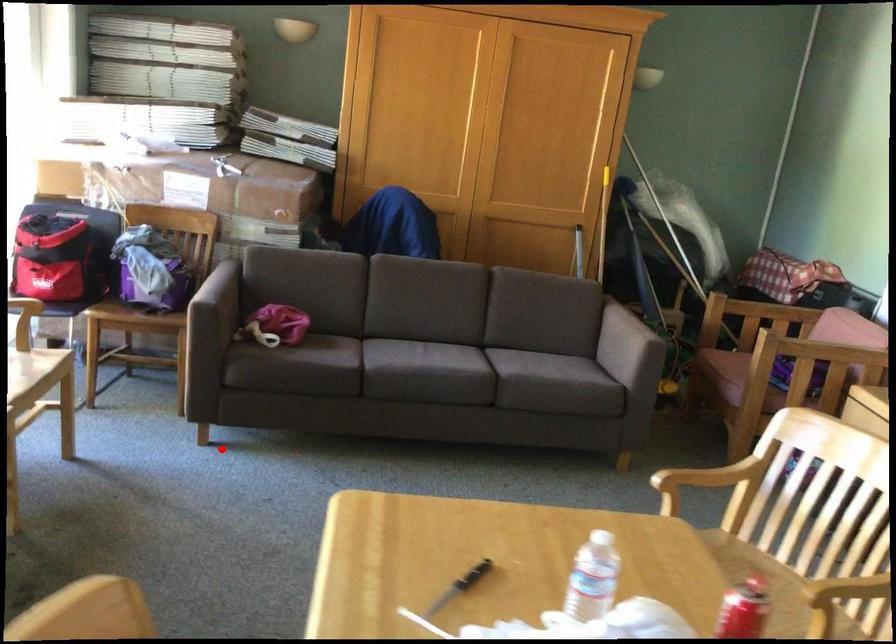
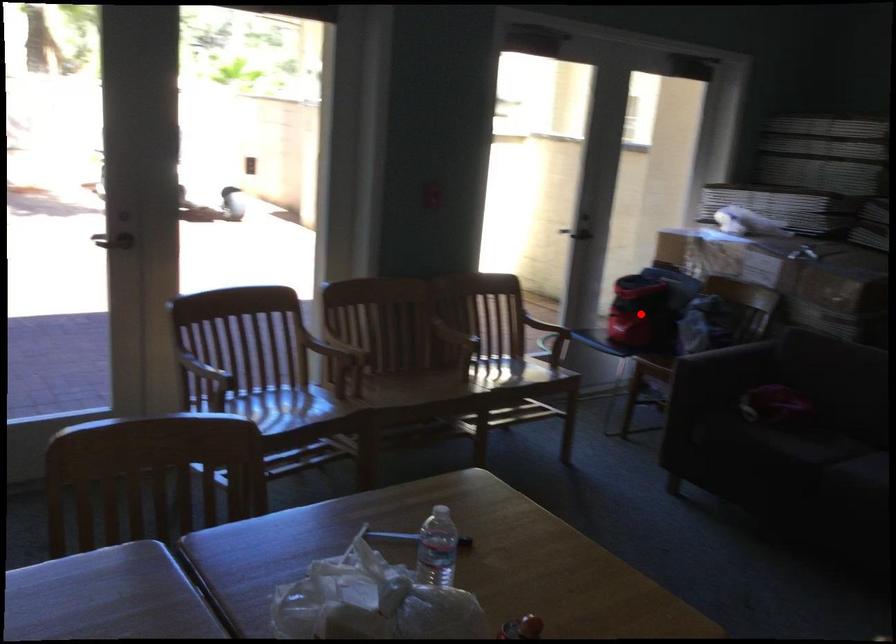
I am providing you with two images of the same scene from different viewpoints. A red point is marked on the first image and another point is marked on the second image. Does the point marked in image1 correspond to the same location as the one in image2?

No